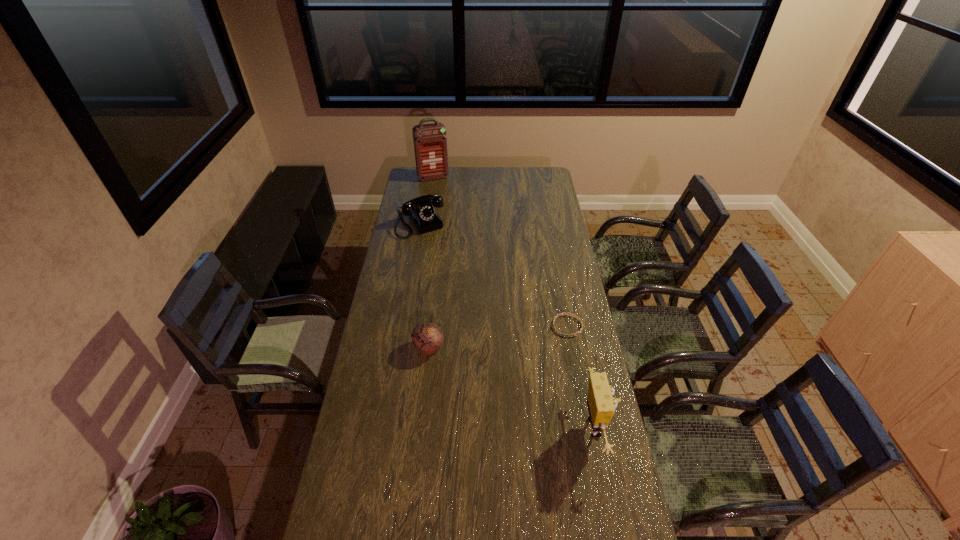
Where is `the first-aid kit that is at the left edge`? This screenshot has height=540, width=960. the first-aid kit that is at the left edge is located at coordinates (430, 142).

Locate an element on the screen. The width and height of the screenshot is (960, 540). sponge located at the right edge is located at coordinates (601, 403).

In order to click on bracelet that is at the right edge in this screenshot , I will do `click(577, 317)`.

The image size is (960, 540). I want to click on object that is positioned at the far left corner, so coord(430,142).

Find the location of `free space at the far edge`. free space at the far edge is located at coordinates (458, 178).

In the image, there is a desktop. Identify the location of vacant space at the near edge. Image resolution: width=960 pixels, height=540 pixels. (413, 524).

Where is `vacant position at the left edge of the desktop`? The width and height of the screenshot is (960, 540). vacant position at the left edge of the desktop is located at coordinates (x=410, y=318).

In order to click on vacant space at the right edge of the desktop in this screenshot , I will do `click(561, 383)`.

The width and height of the screenshot is (960, 540). Find the location of `empty space that is in between the second shortest object and the telephone`. empty space that is in between the second shortest object and the telephone is located at coordinates (424, 286).

Find the location of a particular element. The image size is (960, 540). vacant space that is in between the bracelet and the telephone is located at coordinates (494, 275).